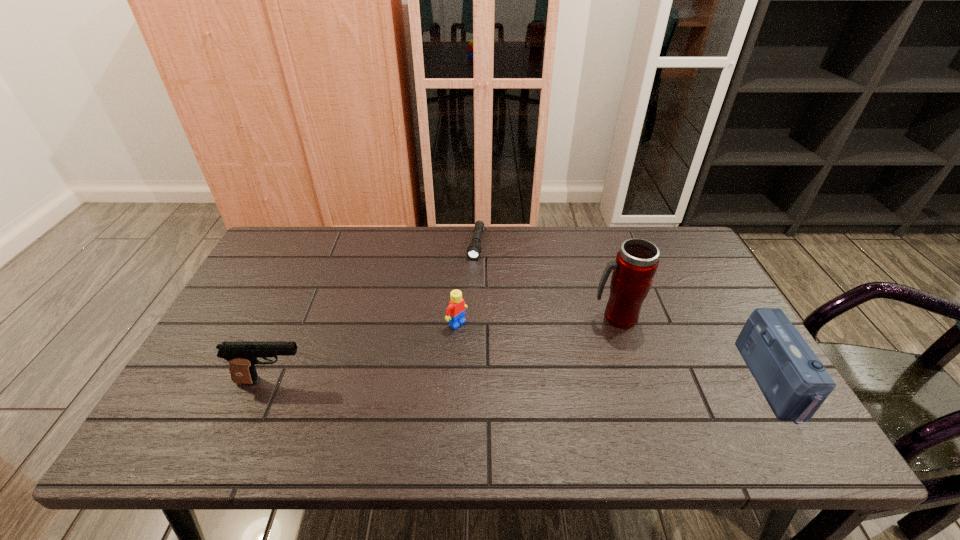
I want to click on object present at the left edge, so click(x=242, y=356).

Locate an element on the screen. The height and width of the screenshot is (540, 960). object situated at the right edge is located at coordinates (795, 383).

Where is `object that is at the near left corner`? This screenshot has height=540, width=960. object that is at the near left corner is located at coordinates (242, 356).

Find the location of `object at the near right corner`. object at the near right corner is located at coordinates (795, 383).

Find the location of `free space at the far edge of the desktop`. free space at the far edge of the desktop is located at coordinates (605, 244).

The width and height of the screenshot is (960, 540). I want to click on free space at the near edge, so click(645, 391).

Identify the location of vacant space at the right edge. (693, 296).

Where is `vacant space at the far left corner of the desktop`? This screenshot has width=960, height=540. vacant space at the far left corner of the desktop is located at coordinates (316, 233).

Image resolution: width=960 pixels, height=540 pixels. Identify the location of vacant space at the near left corner. (217, 390).

In the image, there is a desktop. What are the coordinates of `vacant space at the far right corner` in the screenshot? It's located at (639, 234).